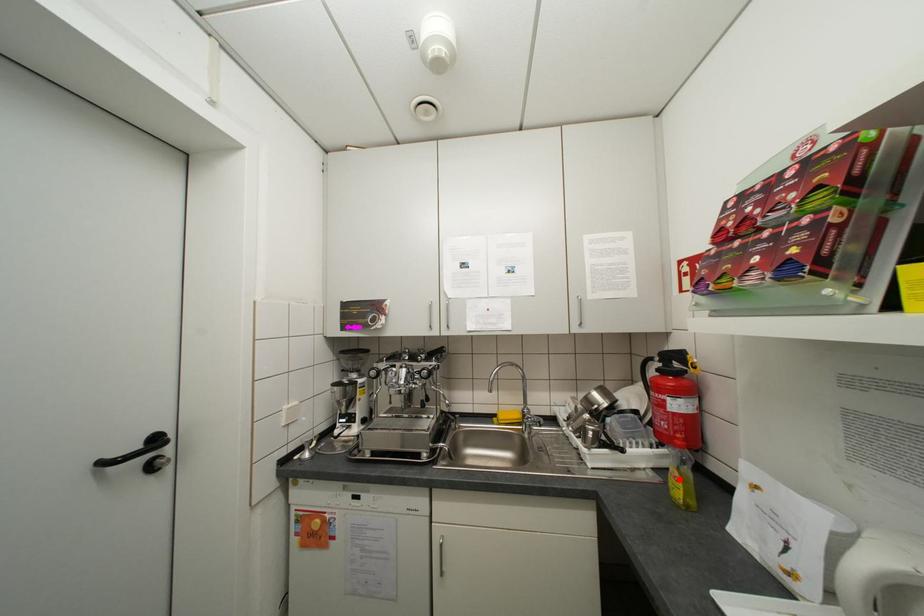
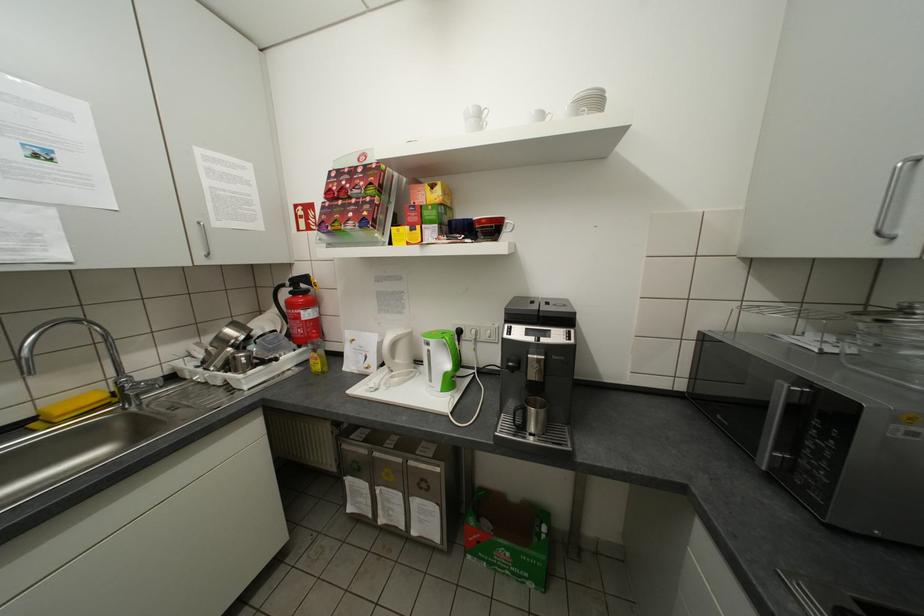
In the second image, find the point that corresponds to the highlighted location in the first image.

(321, 362)